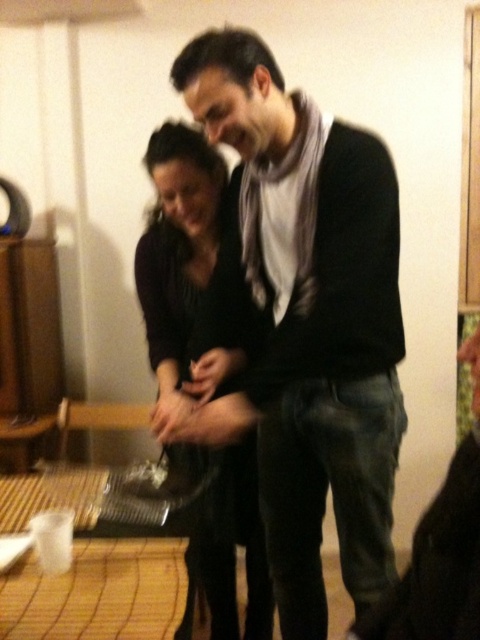
Who is higher up, black matte scarf at center or black matte dress at center?

Positioned higher is black matte dress at center.

Does black matte scarf at center have a larger size compared to black matte dress at center?

Correct, black matte scarf at center is larger in size than black matte dress at center.

Who is more distant from viewer, (275, 532) or (236, 636)?

Point (236, 636)

Identify the location of black matte scarf at center. The image size is (480, 640). (305, 317).